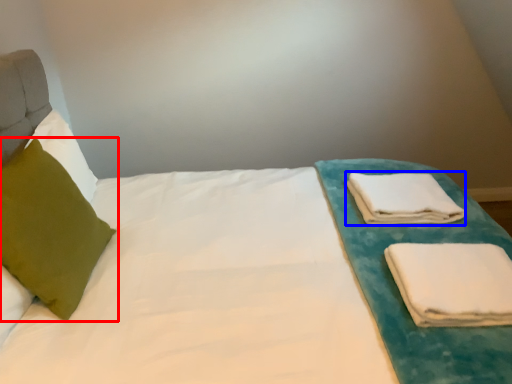
Question: Which of the following is the farthest to the observer, pillow (highlighted by a red box) or cloth (highlighted by a blue box)?

Choices:
 (A) pillow
 (B) cloth

Answer: (B)